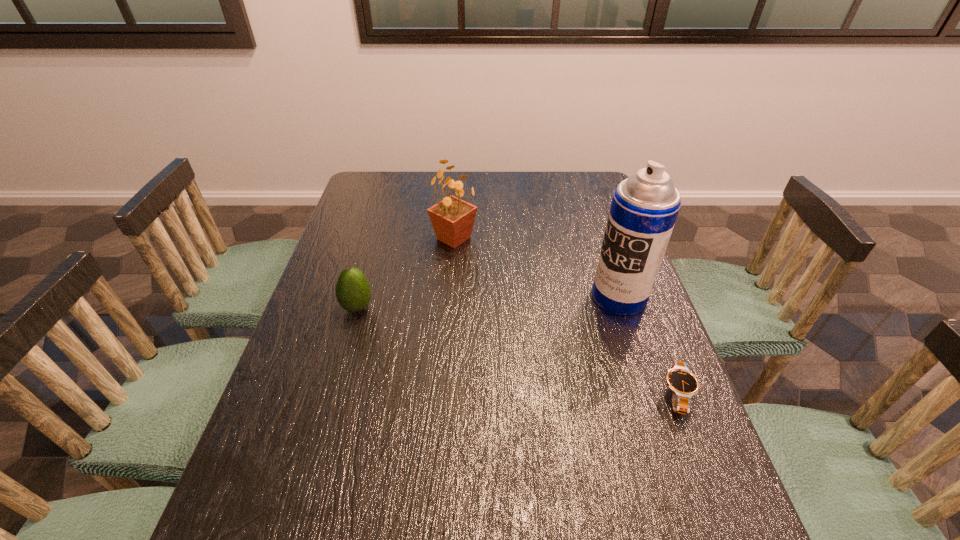
You are a GUI agent. You are given a task and a screenshot of the screen. Output one action in this format:
    pyautogui.click(x=<x>, y=<y>)
    Task: Click on the second shortest object
    The image size is (960, 540).
    Given the screenshot: What is the action you would take?
    pyautogui.click(x=353, y=292)

Find the location of a particular element. This screenshot has width=960, height=540. the leftmost object is located at coordinates (353, 292).

Identify the location of the shortest object. (683, 384).

Find the location of `watch`. watch is located at coordinates (683, 384).

At what (x,y) coordinates should I click in order to perform the action: click on the farthest object. Please return your answer as a coordinate pair (x, y). Looking at the image, I should click on (452, 219).

At what (x,y) coordinates should I click in order to perform the action: click on the third object from right to left. Please return your answer as a coordinate pair (x, y). This screenshot has width=960, height=540. Looking at the image, I should click on (452, 219).

This screenshot has width=960, height=540. In order to click on the tallest object in this screenshot , I will do `click(644, 208)`.

Locate an element on the screen. The image size is (960, 540). vacant space situated 0.090m on the right of the leftmost object is located at coordinates (408, 308).

Identify the location of vacant space located on the left of the watch. The width and height of the screenshot is (960, 540). (584, 394).

Where is `vacant space located at the front of the third shortest object with flowers visible`? Image resolution: width=960 pixels, height=540 pixels. vacant space located at the front of the third shortest object with flowers visible is located at coordinates (460, 322).